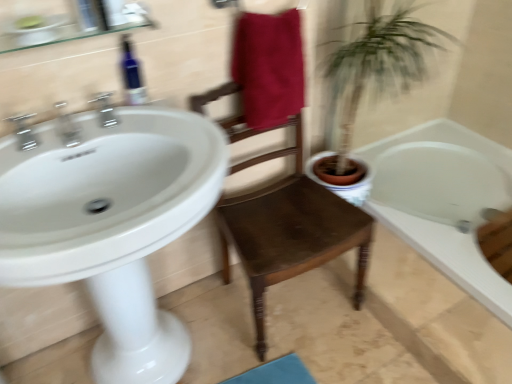
This screenshot has width=512, height=384. Find the location of `free area in between chrome metallic faucet at upper left, acting as the 2th tap starting from the right, and silver metallic faucet at upper left, the first tap in the right-to-left sequence`. free area in between chrome metallic faucet at upper left, acting as the 2th tap starting from the right, and silver metallic faucet at upper left, the first tap in the right-to-left sequence is located at coordinates (94, 136).